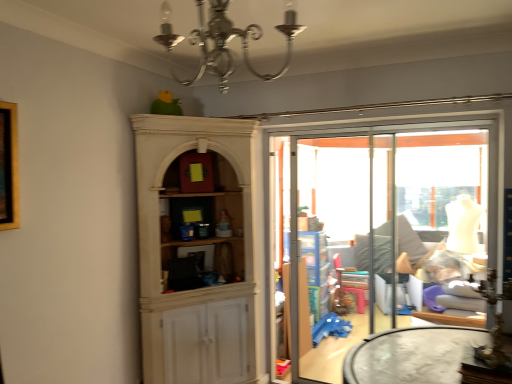
The width and height of the screenshot is (512, 384). What are the coordinates of `transparent glass screen door at center` in the screenshot? It's located at (335, 248).

Locate an element on the screen. The width and height of the screenshot is (512, 384). silver metallic chandelier at upper center is located at coordinates (224, 41).

Is silver metallic chandelier at upper center not near transparent glass screen door at center?

silver metallic chandelier at upper center is positioned a significant distance from transparent glass screen door at center.

Which is behind, point (297, 33) or point (373, 259)?

The point (373, 259) is farther from the camera.

Considering the sizes of silver metallic chandelier at upper center and transparent glass screen door at center in the image, is silver metallic chandelier at upper center taller or shorter than transparent glass screen door at center?

silver metallic chandelier at upper center is shorter than transparent glass screen door at center.

Between silver metallic chandelier at upper center and transparent glass screen door at center, which one has smaller size?

silver metallic chandelier at upper center is smaller.

Looking at this image, would you say transparent glass window at center contains silver metallic chandelier at upper center?

Definitely not — silver metallic chandelier at upper center is not inside transparent glass window at center.

Based on their sizes in the image, would you say transparent glass window at center is bigger or smaller than silver metallic chandelier at upper center?

In the image, transparent glass window at center appears to be larger than silver metallic chandelier at upper center.

Is transparent glass window at center facing towards silver metallic chandelier at upper center?

Yes, transparent glass window at center is aimed at silver metallic chandelier at upper center.

From a real-world perspective, is transparent glass screen door at center positioned above or below silver metallic chandelier at upper center?

transparent glass screen door at center is below silver metallic chandelier at upper center.

Is transparent glass screen door at center not within silver metallic chandelier at upper center?

Yes, transparent glass screen door at center is located beyond the bounds of silver metallic chandelier at upper center.

Measure the distance from transparent glass screen door at center to silver metallic chandelier at upper center.

They are 6.31 feet apart.

What's the angular difference between transparent glass screen door at center and silver metallic chandelier at upper center's facing directions?

transparent glass screen door at center and silver metallic chandelier at upper center are facing 5.8 degrees away from each other.

From a real-world perspective, relative to transparent glass screen door at center, is transparent glass window at center vertically above or below?

Clearly, from a real-world perspective, transparent glass window at center is above transparent glass screen door at center.

Which object is wider, transparent glass window at center or transparent glass screen door at center?

Wider between the two is transparent glass screen door at center.

Is point (439, 219) positioned after point (376, 181)?

No.

Which object is closer to the camera taking this photo, transparent glass window at center or transparent glass screen door at center?

transparent glass window at center.

Where is `screen door behind the transparent glass window at center`? The width and height of the screenshot is (512, 384). screen door behind the transparent glass window at center is located at coordinates (335, 248).

Is transparent glass screen door at center further to camera compared to transparent glass window at center?

Yes, it is behind transparent glass window at center.

Could you tell me if transparent glass screen door at center is facing transparent glass window at center?

No, transparent glass screen door at center is not oriented towards transparent glass window at center.

From a real-world perspective, does silver metallic chandelier at upper center sit lower than transparent glass window at center?

No.

Would you say silver metallic chandelier at upper center is a long distance from transparent glass window at center?

Yes, silver metallic chandelier at upper center and transparent glass window at center are quite far apart.

Where is `window on the right side of silver metallic chandelier at upper center`? The image size is (512, 384). window on the right side of silver metallic chandelier at upper center is located at coordinates (443, 202).

Is transparent glass window at center at the back of silver metallic chandelier at upper center?

Yes, silver metallic chandelier at upper center is positioned with its back facing transparent glass window at center.

This screenshot has width=512, height=384. I want to click on screen door lying below the silver metallic chandelier at upper center (from the image's perspective), so click(x=335, y=248).

The width and height of the screenshot is (512, 384). I want to click on light fixture above the transparent glass window at center (from a real-world perspective), so click(224, 41).

Looking at this image, when comparing their distances from silver metallic chandelier at upper center, does transparent glass screen door at center or transparent glass window at center seem closer?

transparent glass screen door at center lies closer to silver metallic chandelier at upper center than the other object.

Estimate the real-world distances between objects in this image. Which object is closer to transparent glass screen door at center, silver metallic chandelier at upper center or transparent glass window at center?

transparent glass window at center.

Considering their positions, is transparent glass window at center positioned further to transparent glass screen door at center than silver metallic chandelier at upper center?

silver metallic chandelier at upper center is positioned further to the anchor transparent glass screen door at center.

Estimate the real-world distances between objects in this image. Which object is further from transparent glass window at center, silver metallic chandelier at upper center or transparent glass screen door at center?

Based on the image, silver metallic chandelier at upper center appears to be further to transparent glass window at center.

Which object lies further to the anchor point silver metallic chandelier at upper center, transparent glass window at center or transparent glass screen door at center?

transparent glass window at center is positioned further to the anchor silver metallic chandelier at upper center.

Considering their positions, is transparent glass screen door at center positioned closer to transparent glass window at center than silver metallic chandelier at upper center?

transparent glass screen door at center is closer to transparent glass window at center.

Image resolution: width=512 pixels, height=384 pixels. I want to click on window located between silver metallic chandelier at upper center and transparent glass screen door at center in the depth direction, so click(x=443, y=202).